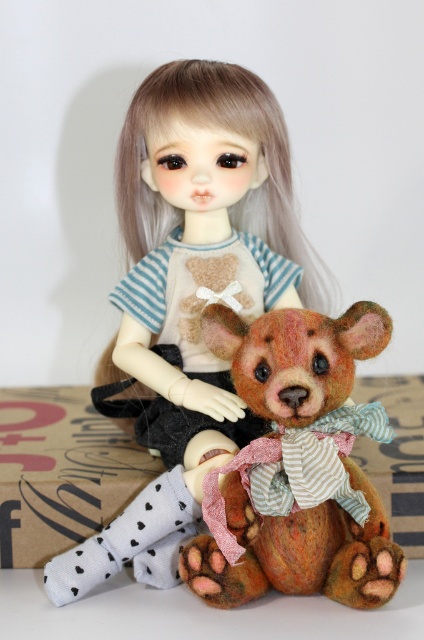
Where is `matte beige doll at center`? matte beige doll at center is located at coordinates (189, 292).